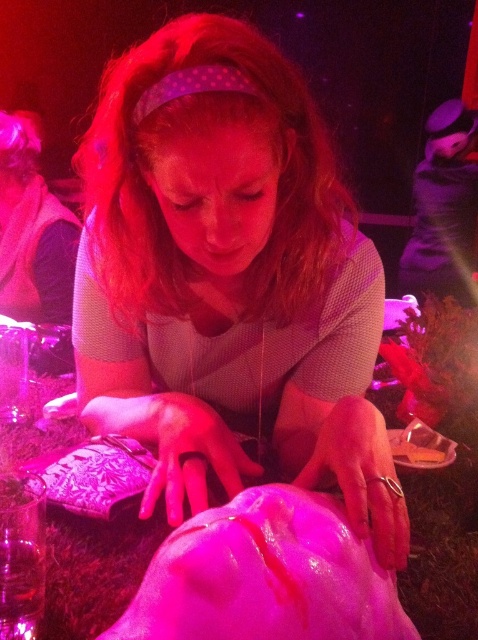
Question: Which point appears closest to the camera in this image?

Choices:
 (A) (360, 284)
 (B) (443, 324)

Answer: (A)

Question: Does matte pink fabric at center have a smaller size compared to pink fabric table at center?

Choices:
 (A) no
 (B) yes

Answer: (B)

Question: Which object is closer to the camera taking this photo?

Choices:
 (A) matte pink fabric at center
 (B) pink fabric table at center

Answer: (A)

Question: Is matte pink fabric at center closer to the viewer compared to pink fabric table at center?

Choices:
 (A) yes
 (B) no

Answer: (A)

Question: Observing the image, what is the correct spatial positioning of matte pink fabric at center in reference to pink fabric table at center?

Choices:
 (A) right
 (B) left

Answer: (A)